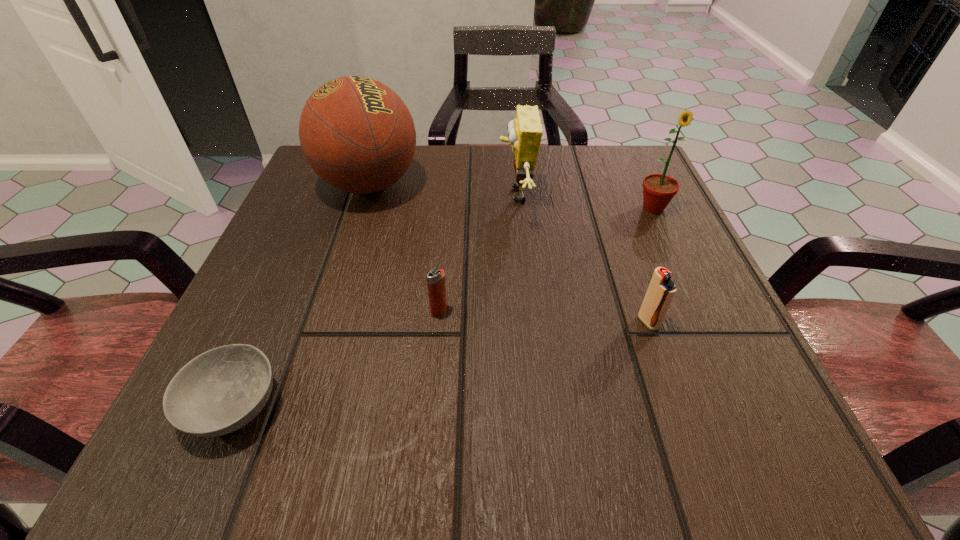
Locate an element on the screen. The width and height of the screenshot is (960, 540). vacant area at the near edge of the desktop is located at coordinates (411, 421).

At what (x,y) coordinates should I click in order to perform the action: click on vacant region at the left edge of the desktop. Please return your answer as a coordinate pair (x, y). Looking at the image, I should click on (324, 234).

Find the location of a particular element. The image size is (960, 540). vacant space at the right edge of the desktop is located at coordinates (651, 241).

At what (x,y) coordinates should I click in order to perform the action: click on vacant point at the far left corner. Please return your answer as a coordinate pair (x, y). Looking at the image, I should click on (349, 205).

The image size is (960, 540). In order to click on free location at the far right corner of the desktop in this screenshot , I will do `click(606, 164)`.

Identify the location of empty location between the basketball and the rightmost object. The width and height of the screenshot is (960, 540). pos(511,197).

Locate an element on the screen. unoccupied position between the bowl and the basketball is located at coordinates (301, 295).

You are a GUI agent. You are given a task and a screenshot of the screen. Output one action in this format:
    pyautogui.click(x=<x>, y=<y>)
    Task: Click on the vacant space in between the right igniter and the fifth tallest object
    This screenshot has width=960, height=540.
    Given the screenshot: What is the action you would take?
    pyautogui.click(x=543, y=316)

In order to click on free space between the basketball and the fourth shortest object in this screenshot , I will do `click(443, 190)`.

The image size is (960, 540). I want to click on vacant area that lies between the fourth tallest object and the shorter igniter, so click(x=543, y=316).